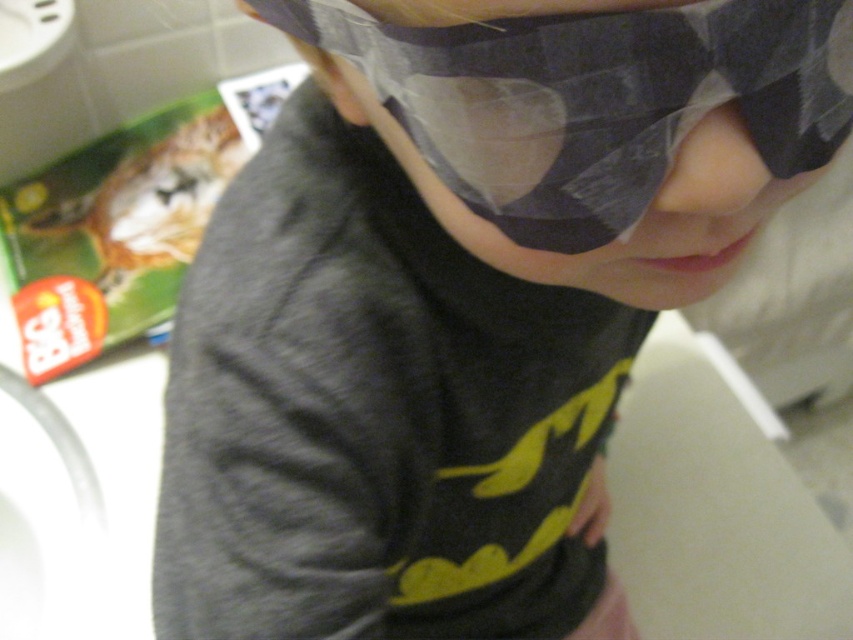
Question: Which point is closer to the camera?

Choices:
 (A) matte black eye mask at center
 (B) pink smooth skin at center

Answer: (A)

Question: Which of the following is the closest to the observer?

Choices:
 (A) pink smooth skin at center
 (B) matte black eye mask at center

Answer: (B)

Question: Is matte black eye mask at center thinner than pink smooth skin at center?

Choices:
 (A) no
 (B) yes

Answer: (A)

Question: Is matte black eye mask at center smaller than pink smooth skin at center?

Choices:
 (A) yes
 (B) no

Answer: (B)

Question: Does matte black eye mask at center have a larger size compared to pink smooth skin at center?

Choices:
 (A) no
 (B) yes

Answer: (B)